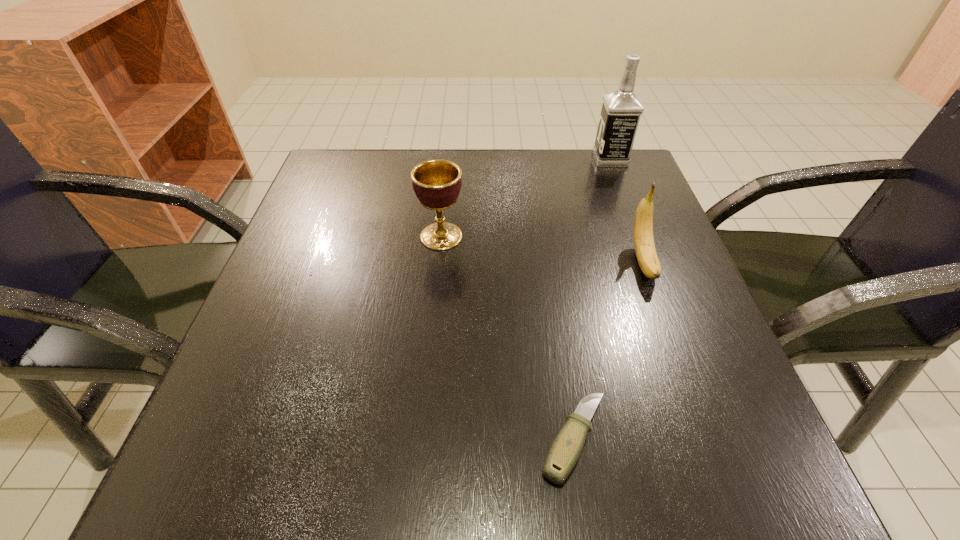
Where is `the tallest object`? The height and width of the screenshot is (540, 960). the tallest object is located at coordinates (621, 110).

Identify the location of the farthest object. (621, 110).

This screenshot has width=960, height=540. I want to click on chalice, so click(437, 183).

Locate an element on the screen. banana is located at coordinates (645, 250).

Identify the location of the shortest object. The image size is (960, 540). (565, 451).

Identify the location of pocketknife. The height and width of the screenshot is (540, 960). (565, 451).

Identify the location of free space located on the front label of the vodka. (524, 159).

Find the location of a particular element. The height and width of the screenshot is (540, 960). free region located 0.160m on the front label of the vodka is located at coordinates (528, 159).

This screenshot has width=960, height=540. I want to click on vacant area situated 0.310m on the front label of the vodka, so click(467, 159).

Find the location of a particular element. This screenshot has height=540, width=960. vacant space located 0.180m on the left of the chalice is located at coordinates (327, 237).